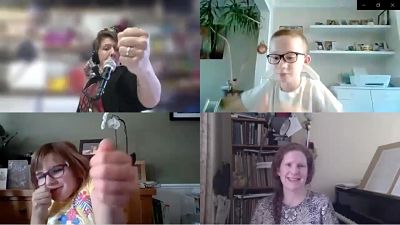
The width and height of the screenshot is (400, 225). I want to click on back walls, so click(305, 15), click(346, 134), click(178, 147), click(37, 120).